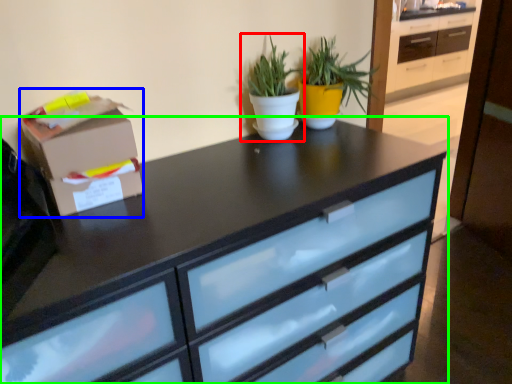
Question: Which object is positioned farthest from houseplant (highlighted by a red box)? Select from cardboard box (highlighted by a blue box) and chest of drawers (highlighted by a green box).

Choices:
 (A) cardboard box
 (B) chest of drawers

Answer: (A)